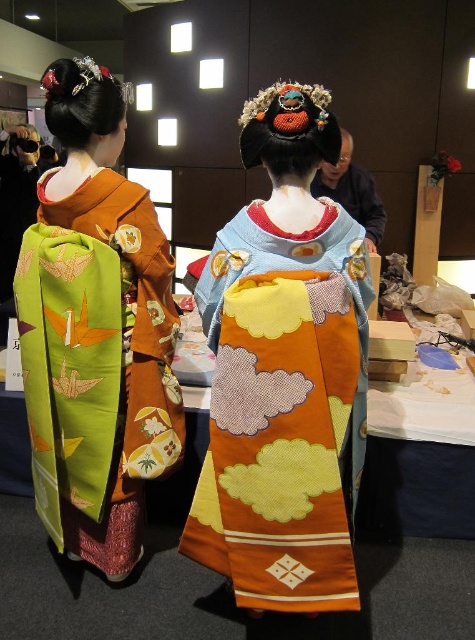
Question: Can you confirm if silky orange kimono at center is positioned below green silk kimono at left?

Choices:
 (A) yes
 (B) no

Answer: (A)

Question: Among these points, which one is farthest from the camera?

Choices:
 (A) (58, 442)
 (B) (229, 285)

Answer: (A)

Question: Is silky orange kimono at center bigger than green silk kimono at left?

Choices:
 (A) no
 (B) yes

Answer: (A)

Question: Which point is farther to the camera?

Choices:
 (A) (149, 280)
 (B) (287, 90)

Answer: (A)

Question: Does silky orange kimono at center have a smaller size compared to green silk kimono at left?

Choices:
 (A) yes
 (B) no

Answer: (A)

Question: Which of the following is the closest to the observer?

Choices:
 (A) [x=93, y=140]
 (B) [x=298, y=328]

Answer: (B)